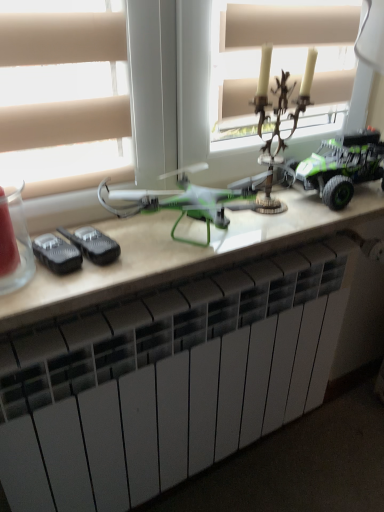
Describe the element at coordinates (181, 253) in the screenshot. I see `green plastic drone at center` at that location.

Locate an element on the screen. green plastic drone at center is located at coordinates (181, 253).

What do you see at coordinates (342, 166) in the screenshot? The width and height of the screenshot is (384, 512). I see `green matte toy truck at right, the 1th toy viewed from the right` at bounding box center [342, 166].

This screenshot has width=384, height=512. What are the coordinates of `antique bronze candlestick at upper center, which is the first toy in left-to-right order` in the screenshot? It's located at (272, 155).

The height and width of the screenshot is (512, 384). I want to click on white matte radiator at lower center, so click(167, 382).

Measure the distance between white matte radiator at lower center and camera.

white matte radiator at lower center is 26.68 inches away from camera.

Where is `green plastic drone at center`? green plastic drone at center is located at coordinates (181, 253).

Considering the sizes of antique bronze candlestick at upper center, which is the first toy in left-to-right order, and green matte toy truck at right, marked as the 2th toy in a left-to-right arrangement, in the image, is antique bronze candlestick at upper center, which is the first toy in left-to-right order, bigger or smaller than green matte toy truck at right, marked as the 2th toy in a left-to-right arrangement,?

Clearly, antique bronze candlestick at upper center, which is the first toy in left-to-right order, is smaller in size than green matte toy truck at right, marked as the 2th toy in a left-to-right arrangement.

Does antique bronze candlestick at upper center, which is the first toy in left-to-right order, have a greater width compared to green matte toy truck at right, marked as the 2th toy in a left-to-right arrangement?

Incorrect, the width of antique bronze candlestick at upper center, which is the first toy in left-to-right order, does not surpass that of green matte toy truck at right, marked as the 2th toy in a left-to-right arrangement.

Which object is further away from the camera, antique bronze candlestick at upper center, which is the first toy in left-to-right order, or green matte toy truck at right, the 1th toy viewed from the right?

green matte toy truck at right, the 1th toy viewed from the right, is behind.

Between antique bronze candlestick at upper center, the 2th toy positioned from the right, and green matte toy truck at right, the 1th toy viewed from the right, which one has less height?

green matte toy truck at right, the 1th toy viewed from the right, is shorter.

Are white matte radiator at lower center and antique bronze candlestick at upper center, which is the first toy in left-to-right order, beside each other?

No, white matte radiator at lower center is not in contact with antique bronze candlestick at upper center, which is the first toy in left-to-right order.

Which object is closer to the camera taking this photo, white matte radiator at lower center or antique bronze candlestick at upper center, the 2th toy positioned from the right?

white matte radiator at lower center.

From the image's perspective, which one is positioned lower, white matte radiator at lower center or antique bronze candlestick at upper center, which is the first toy in left-to-right order?

white matte radiator at lower center is shown below in the image.

Is white matte radiator at lower center outside of green plastic drone at center?

Indeed, white matte radiator at lower center is completely outside green plastic drone at center.

Consider the image. Is white matte radiator at lower center placed right next to green plastic drone at center?

white matte radiator at lower center is not next to green plastic drone at center, and they're not touching.

From a real-world perspective, which object rests below the other?

From a 3D spatial view, white matte radiator at lower center is below.

Locate an element on the screen. table above the white matte radiator at lower center (from a real-world perspective) is located at coordinates (181, 253).

Is green plastic drone at center positioned beyond the bounds of green matte toy truck at right, the 1th toy viewed from the right?

Absolutely, green plastic drone at center is external to green matte toy truck at right, the 1th toy viewed from the right.

From a real-world perspective, between green plastic drone at center and green matte toy truck at right, the 1th toy viewed from the right, who is vertically lower?

green plastic drone at center is physically lower.

Could you tell me if green plastic drone at center is turned towards green matte toy truck at right, the 1th toy viewed from the right?

No.

Is point (153, 236) more distant than point (336, 143)?

That is False.

Is the position of green plastic drone at center more distant than that of antique bronze candlestick at upper center, which is the first toy in left-to-right order?

No, green plastic drone at center is in front of antique bronze candlestick at upper center, which is the first toy in left-to-right order.

Where is `the 2nd toy above the green plastic drone at center (from the image's perspective)`? The height and width of the screenshot is (512, 384). the 2nd toy above the green plastic drone at center (from the image's perspective) is located at coordinates (272, 155).

Do you think green plastic drone at center is within antique bronze candlestick at upper center, which is the first toy in left-to-right order, or outside of it?

green plastic drone at center is not inside antique bronze candlestick at upper center, which is the first toy in left-to-right order, it's outside.

Is green plastic drone at center directly adjacent to antique bronze candlestick at upper center, which is the first toy in left-to-right order?

green plastic drone at center and antique bronze candlestick at upper center, which is the first toy in left-to-right order, are not in contact.

I want to click on table lying in front of the antique bronze candlestick at upper center, the 2th toy positioned from the right, so click(181, 253).

Which object is positioned more to the right, antique bronze candlestick at upper center, the 2th toy positioned from the right, or green plastic drone at center?

From the viewer's perspective, antique bronze candlestick at upper center, the 2th toy positioned from the right, appears more on the right side.

From a real-world perspective, is antique bronze candlestick at upper center, which is the first toy in left-to-right order, over green plastic drone at center?

Yes, from a real-world perspective, antique bronze candlestick at upper center, which is the first toy in left-to-right order, is above green plastic drone at center.

Considering the sizes of white matte radiator at lower center and green matte toy truck at right, marked as the 2th toy in a left-to-right arrangement, in the image, is white matte radiator at lower center wider or thinner than green matte toy truck at right, marked as the 2th toy in a left-to-right arrangement,?

Considering their sizes, white matte radiator at lower center looks slimmer than green matte toy truck at right, marked as the 2th toy in a left-to-right arrangement.

Between white matte radiator at lower center and green matte toy truck at right, the 1th toy viewed from the right, which one has less height?

green matte toy truck at right, the 1th toy viewed from the right, is shorter.

How much distance is there between white matte radiator at lower center and green matte toy truck at right, marked as the 2th toy in a left-to-right arrangement?

46.39 centimeters.

Find the location of a particular element. Image resolution: width=384 pixels, height=512 pixels. toy directly beneath the antique bronze candlestick at upper center, the 2th toy positioned from the right (from a real-world perspective) is located at coordinates (342, 166).

The height and width of the screenshot is (512, 384). There is a white matte radiator at lower center. Find the location of `the 2nd toy above it (from a real-world perspective)`. the 2nd toy above it (from a real-world perspective) is located at coordinates (272, 155).

Considering their positions, is antique bronze candlestick at upper center, which is the first toy in left-to-right order, positioned closer to white matte radiator at lower center than green plastic drone at center?

green plastic drone at center.

When comparing their distances from white matte radiator at lower center, does green matte toy truck at right, the 1th toy viewed from the right, or antique bronze candlestick at upper center, which is the first toy in left-to-right order, seem further?

green matte toy truck at right, the 1th toy viewed from the right, lies further to white matte radiator at lower center than the other object.

When comparing their distances from green plastic drone at center, does white matte radiator at lower center or green matte toy truck at right, the 1th toy viewed from the right, seem further?

white matte radiator at lower center.

Looking at the image, which one is located closer to green matte toy truck at right, the 1th toy viewed from the right, antique bronze candlestick at upper center, which is the first toy in left-to-right order, or green plastic drone at center?

The object closer to green matte toy truck at right, the 1th toy viewed from the right, is antique bronze candlestick at upper center, which is the first toy in left-to-right order.

Which object lies nearer to the anchor point green matte toy truck at right, the 1th toy viewed from the right, white matte radiator at lower center or antique bronze candlestick at upper center, which is the first toy in left-to-right order?

antique bronze candlestick at upper center, which is the first toy in left-to-right order.

Which object lies nearer to the anchor point green plastic drone at center, antique bronze candlestick at upper center, which is the first toy in left-to-right order, or white matte radiator at lower center?

antique bronze candlestick at upper center, which is the first toy in left-to-right order.

Based on their spatial positions, is green plastic drone at center or antique bronze candlestick at upper center, the 2th toy positioned from the right, further from white matte radiator at lower center?

Among the two, antique bronze candlestick at upper center, the 2th toy positioned from the right, is located further to white matte radiator at lower center.

When comparing their distances from white matte radiator at lower center, does green plastic drone at center or green matte toy truck at right, the 1th toy viewed from the right, seem further?

Based on the image, green matte toy truck at right, the 1th toy viewed from the right, appears to be further to white matte radiator at lower center.

Where is `toy located between green plastic drone at center and green matte toy truck at right, the 1th toy viewed from the right, in the left-right direction`? The width and height of the screenshot is (384, 512). toy located between green plastic drone at center and green matte toy truck at right, the 1th toy viewed from the right, in the left-right direction is located at coordinates (272, 155).

Locate an element on the screen. table between green matte toy truck at right, marked as the 2th toy in a left-to-right arrangement, and white matte radiator at lower center from top to bottom is located at coordinates (181, 253).

The width and height of the screenshot is (384, 512). What are the coordinates of `table between antique bronze candlestick at upper center, which is the first toy in left-to-right order, and white matte radiator at lower center in the up-down direction` in the screenshot? It's located at coord(181,253).

This screenshot has height=512, width=384. I want to click on toy between antique bronze candlestick at upper center, which is the first toy in left-to-right order, and white matte radiator at lower center in the up-down direction, so click(x=342, y=166).